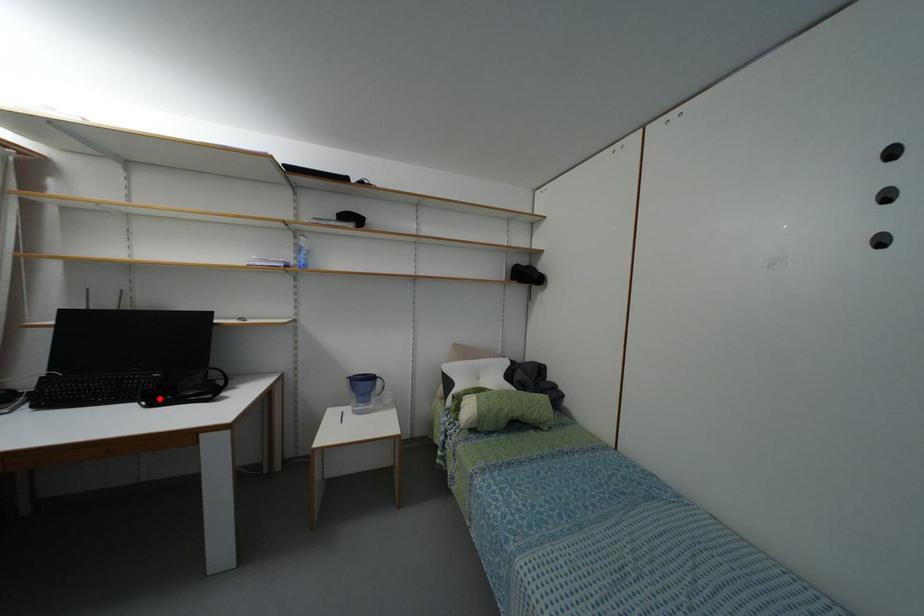
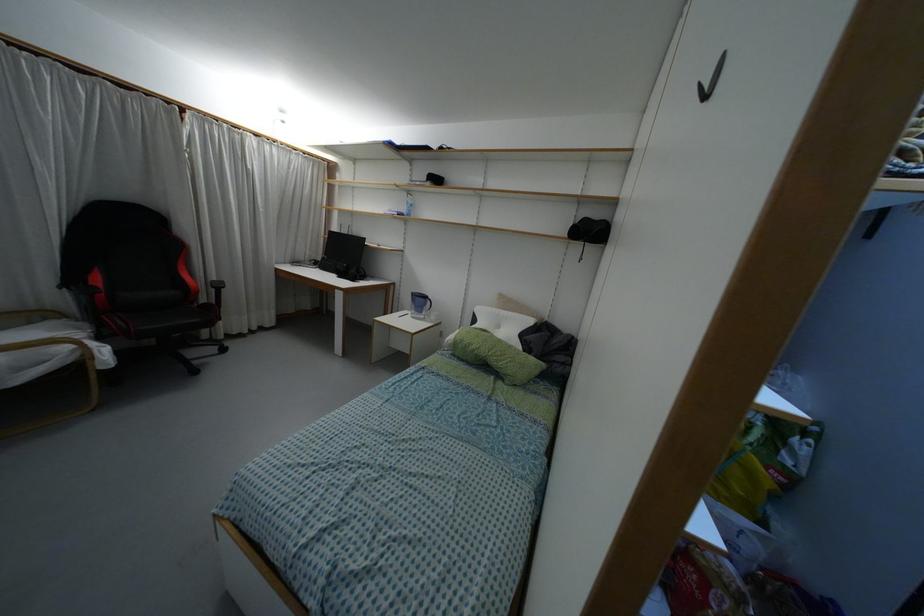
Locate, in the second image, the point that corresponds to the highlighted location in the first image.

(341, 275)